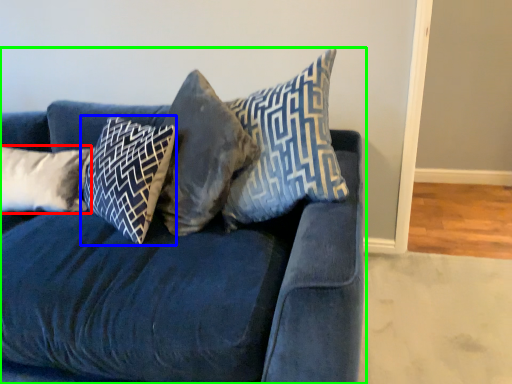
Question: Which is farther away from pillow (highlighted by a red box)? pillow (highlighted by a blue box) or studio couch (highlighted by a green box)?

Choices:
 (A) pillow
 (B) studio couch

Answer: (B)